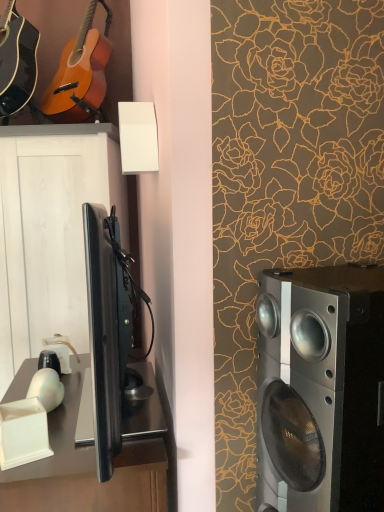
Question: Would you say matte black acoustic guitar at upper left, which is counted as the second guitar, starting from the right, is to the left or to the right of matte orange wood guitar at upper left, which is the 1th guitar from right to left, in the picture?

Choices:
 (A) left
 (B) right

Answer: (A)

Question: Which is correct: matte black acoustic guitar at upper left, which is counted as the second guitar, starting from the right, is inside matte orange wood guitar at upper left, the 2th guitar positioned from the left, or outside of it?

Choices:
 (A) outside
 (B) inside

Answer: (A)

Question: Estimate the real-world distances between objects in this image. Which object is closer to the satin black desk at lower left?

Choices:
 (A) matte black acoustic guitar at upper left, which is counted as the second guitar, starting from the right
 (B) silver metallic speaker at right
 (C) matte orange wood guitar at upper left, which is the 1th guitar from right to left
 (D) black glossy cabinet at left

Answer: (B)

Question: Estimate the real-world distances between objects in this image. Which object is closer to the silver metallic speaker at right?

Choices:
 (A) matte black acoustic guitar at upper left, marked as the first guitar in a left-to-right arrangement
 (B) matte orange wood guitar at upper left, which is the 1th guitar from right to left
 (C) satin black desk at lower left
 (D) black glossy cabinet at left

Answer: (C)